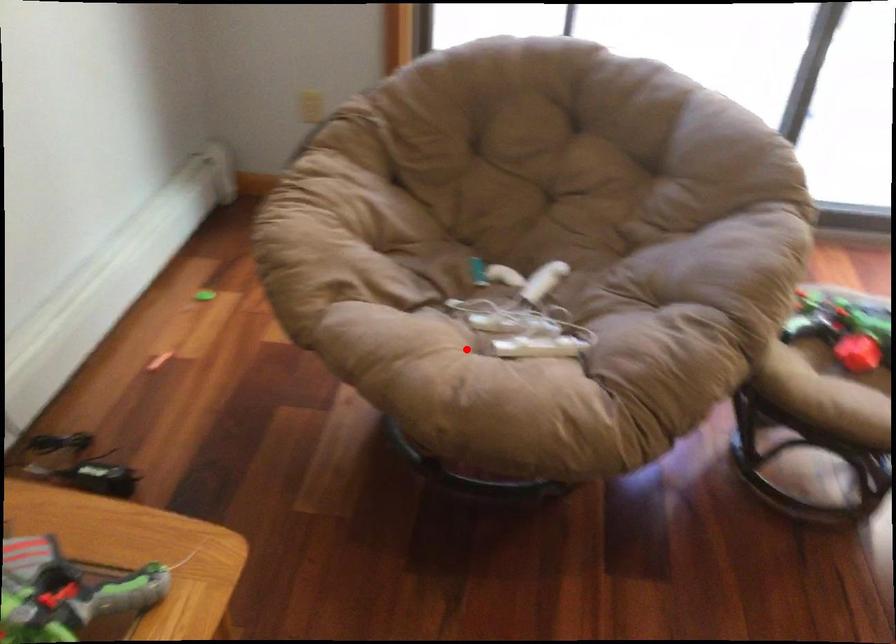
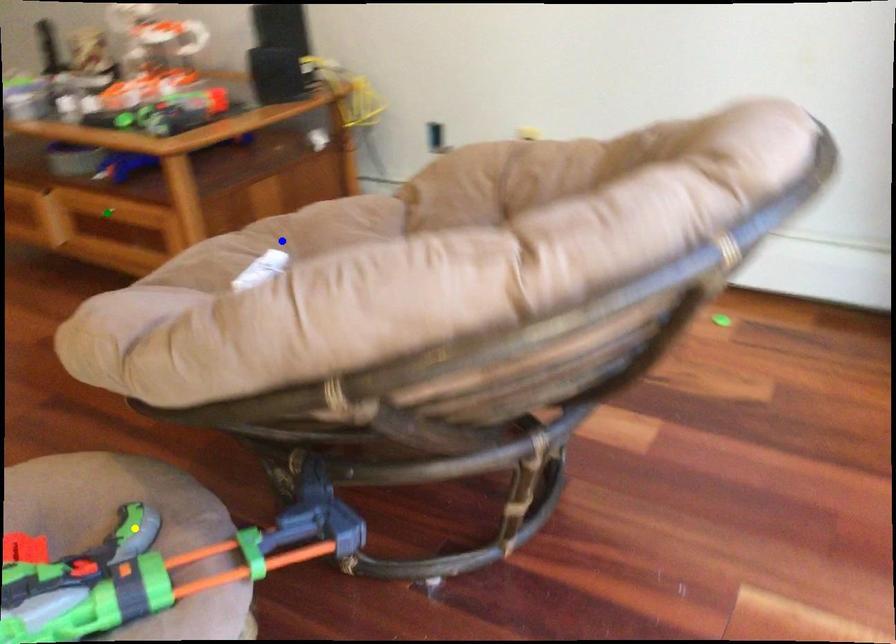
Question: I am providing you with two images of the same scene from different viewpoints. A red point is marked on the first image. You are given multiple points on the second image. Can you choose the point in image 2 that corresponds to the point in image 1?

Choices:
 (A) yellow point
 (B) blue point
 (C) green point

Answer: (B)